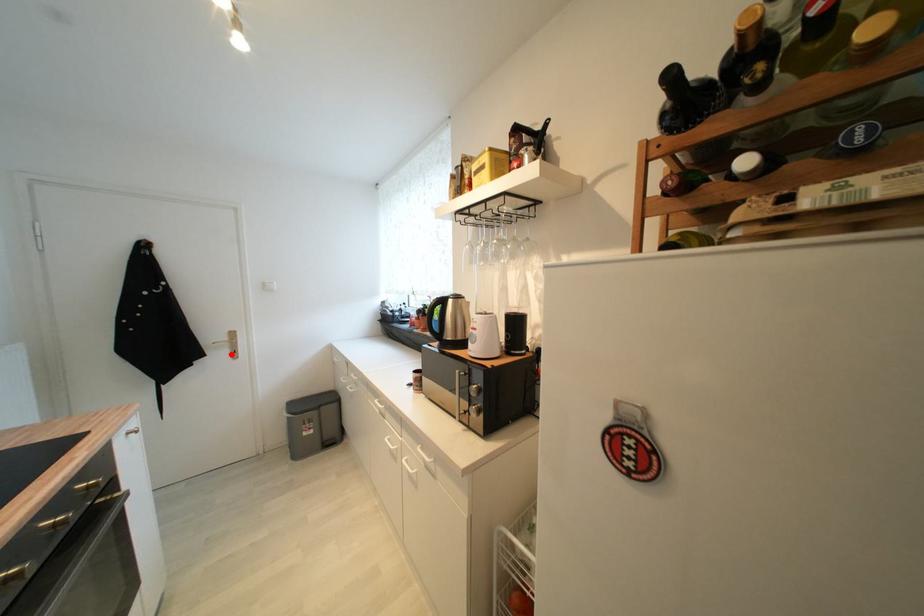
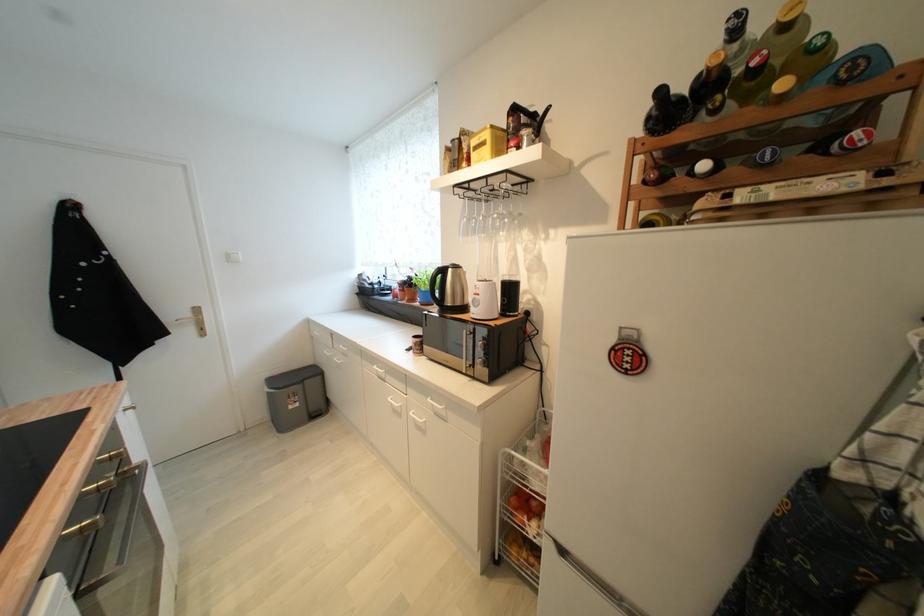
Find the pixel in the second image that matches the highlighted location in the first image.

(197, 331)